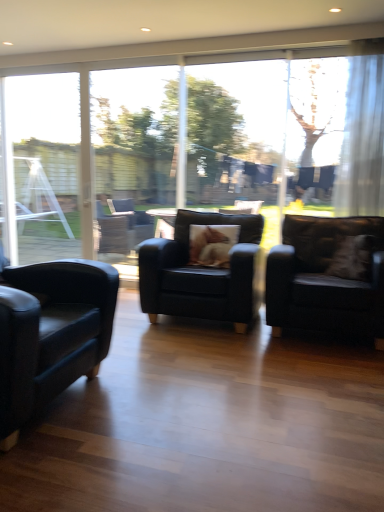
Locate an element on the screen. Image resolution: width=384 pixels, height=512 pixels. vacant area that lies between matte black armchair at left, placed as the first chair when sorted from left to right, and matte black armchair at right, the 1th chair in the right-to-left sequence is located at coordinates (219, 371).